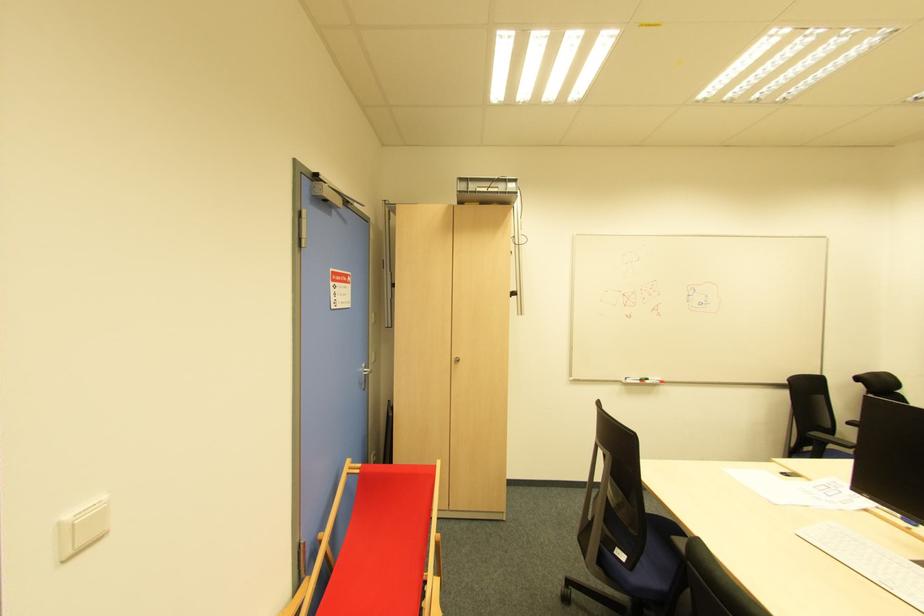
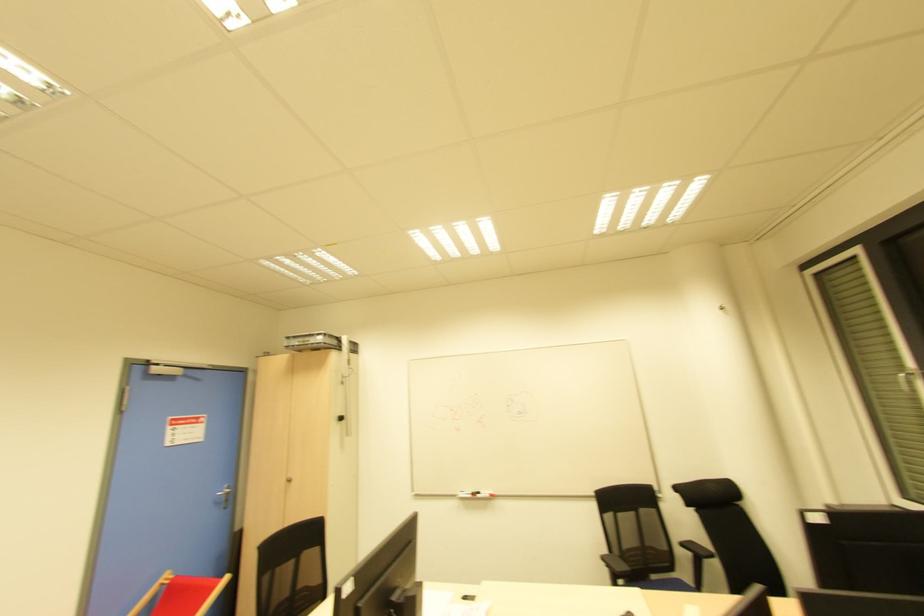
Find the pixel in the second image that matches [662,383] in the first image.

(492, 496)